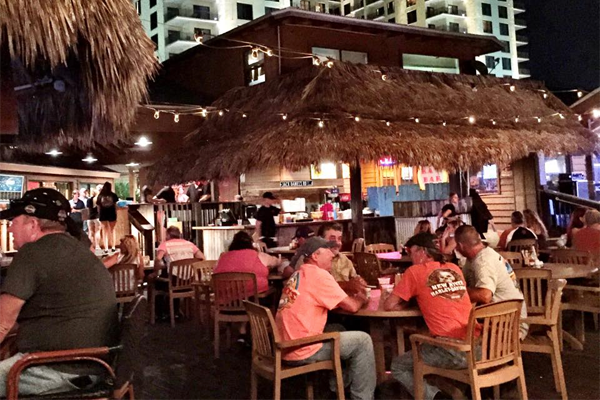
Where is `black metallic chair`? This screenshot has height=400, width=600. black metallic chair is located at coordinates (120, 347).